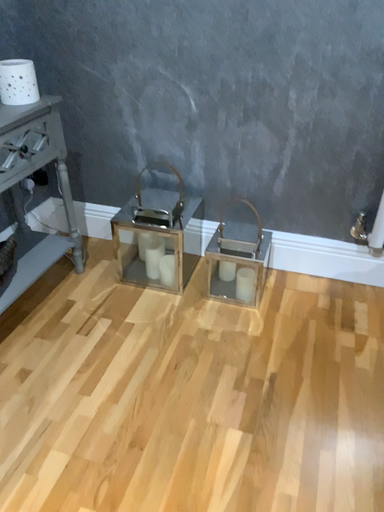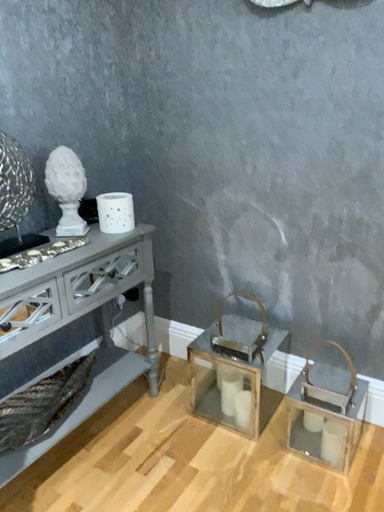
Question: How did the camera likely rotate when shooting the video?

Choices:
 (A) rotated right
 (B) rotated left

Answer: (B)